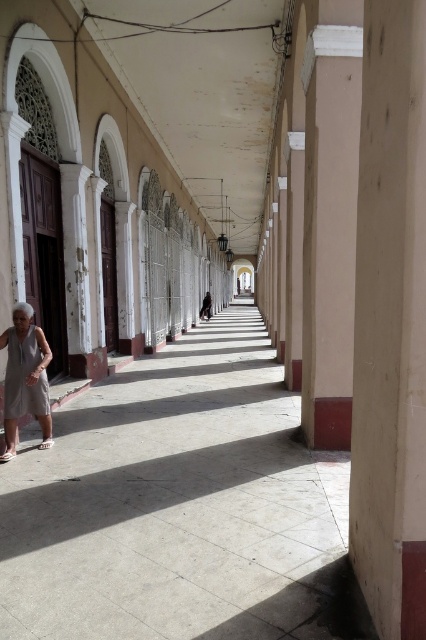
You are an architect designing a new column that must be wider than the gray fabric dress at lower left. Can the smooth concrete pillar at center be used as a reference for the minimum width required?

The smooth concrete pillar at center has a lesser width compared to the gray fabric dress at lower left, so it cannot be used as a reference for the minimum width required since it is narrower than the dress.